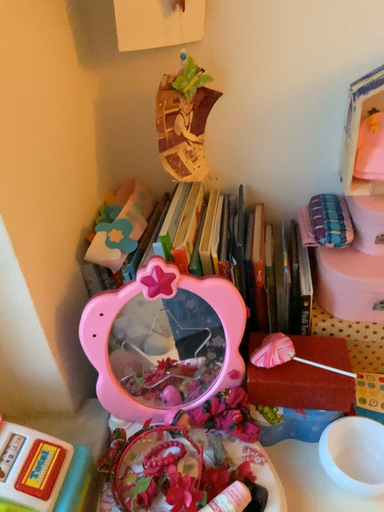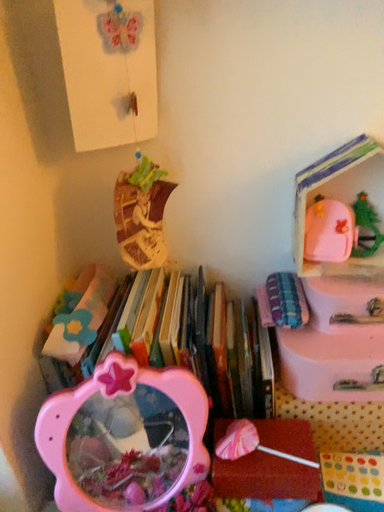
Question: Which way did the camera rotate in the video?

Choices:
 (A) rotated upward
 (B) rotated downward

Answer: (A)